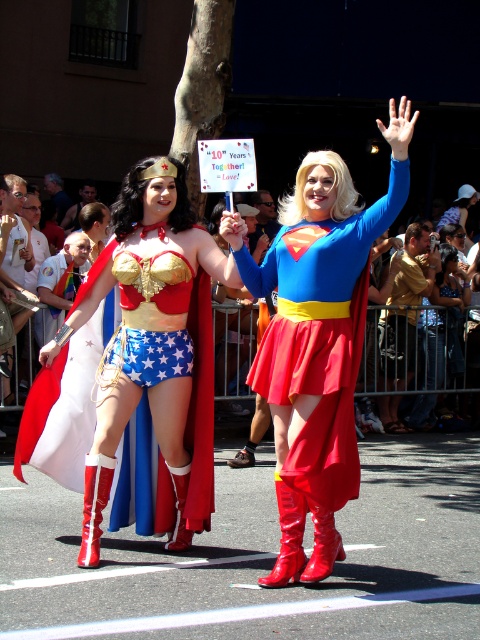
Between shiny red boots at center and shiny metallic cape at center, which one has less height?

shiny metallic cape at center

What do you see at coordinates (317, 340) in the screenshot? The height and width of the screenshot is (640, 480). I see `shiny red boots at center` at bounding box center [317, 340].

Image resolution: width=480 pixels, height=640 pixels. I want to click on shiny red boots at center, so click(317, 340).